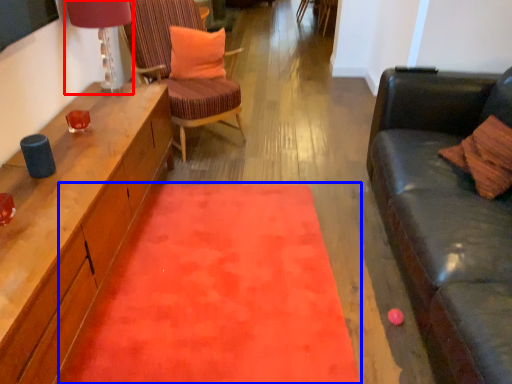
Question: Which point is closer to the camera, lamp (highlighted by a red box) or mat (highlighted by a blue box)?

Choices:
 (A) lamp
 (B) mat

Answer: (B)